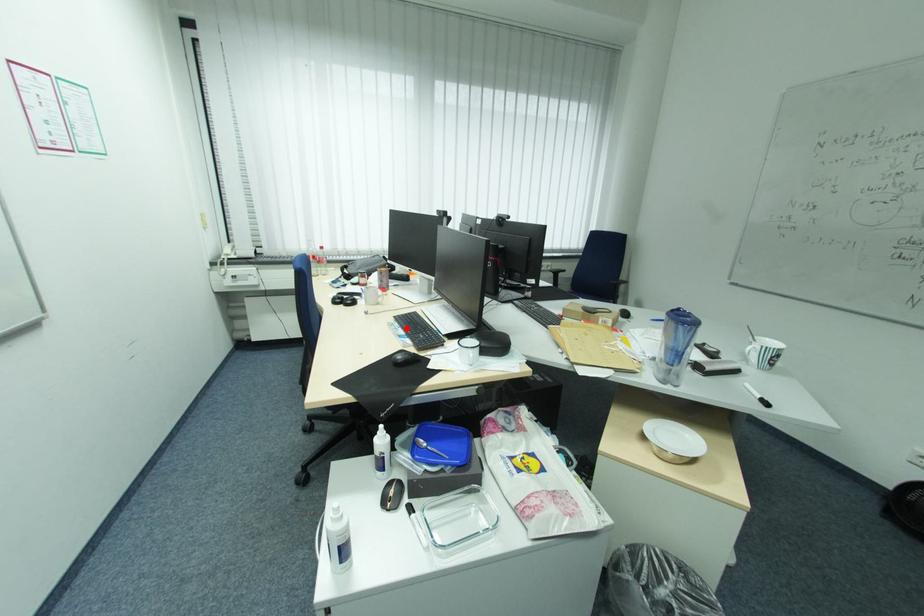
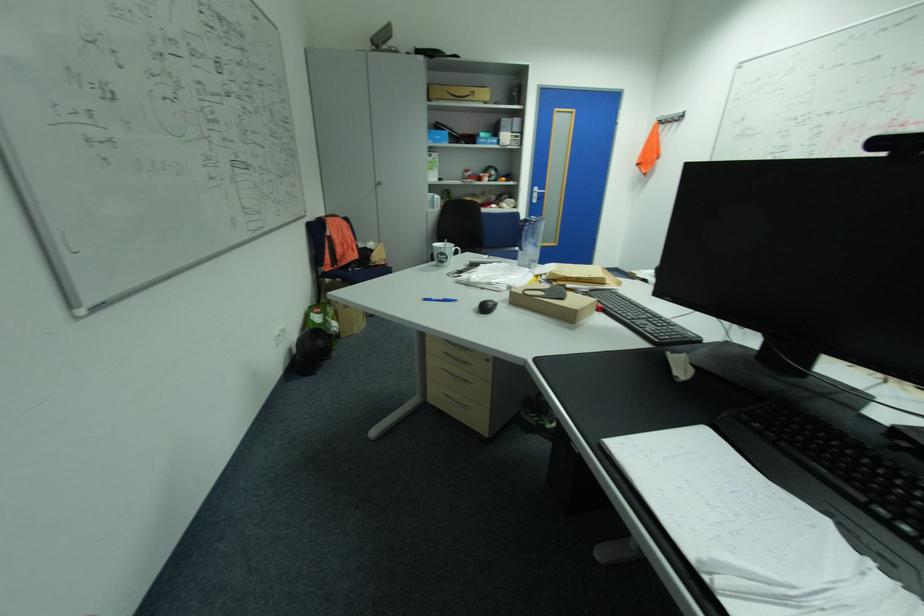
Question: I am providing you with two images of the same scene from different viewpoints. A red point is marked on the first image. Is the red point's position out of view in image 2?

Choices:
 (A) Yes
 (B) No

Answer: (A)